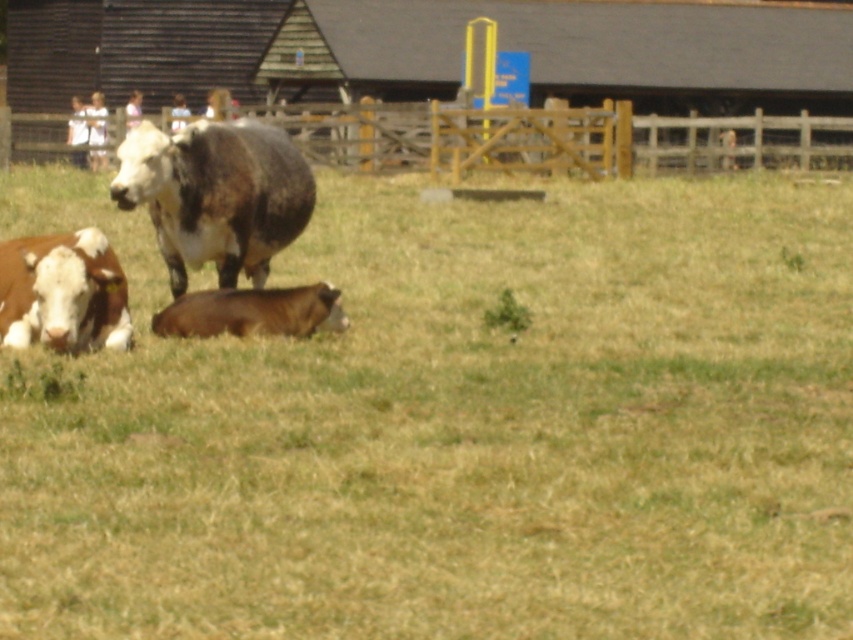
Between point (262, 348) and point (238, 161), which one is positioned behind?

The point (238, 161) is behind.

Locate an element on the screen. This screenshot has height=640, width=853. brown grassy at lower left is located at coordinates (459, 426).

Does brown shaggy bull at center have a greater width compared to brown speckled cow at lower left?

Correct, the width of brown shaggy bull at center exceeds that of brown speckled cow at lower left.

This screenshot has width=853, height=640. Describe the element at coordinates (216, 195) in the screenshot. I see `brown shaggy bull at center` at that location.

You are a GUI agent. You are given a task and a screenshot of the screen. Output one action in this format:
    pyautogui.click(x=<x>, y=<y>)
    Task: Click on the brown shaggy bull at center
    This screenshot has height=640, width=853.
    Given the screenshot: What is the action you would take?
    pyautogui.click(x=216, y=195)

Locate an element on the screen. The image size is (853, 640). brown shaggy bull at center is located at coordinates (216, 195).

Who is more distant from viewer, (651,115) or (248,275)?

The point (651,115) is more distant.

Identify the location of wooden fence at upper center. (556, 138).